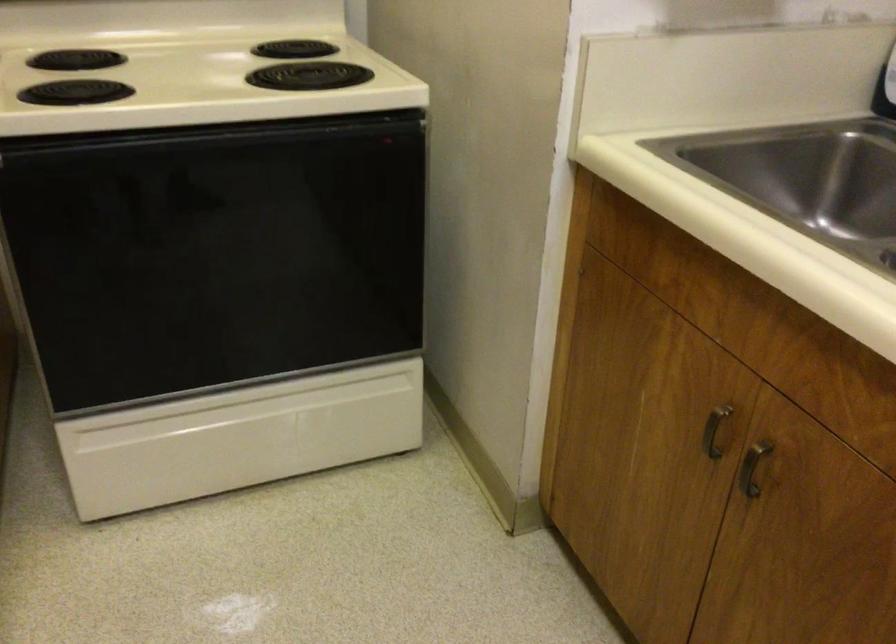
Find where to pull the oven drawer handle. Please return your answer as a coordinate pair (x, y).

(250, 410)